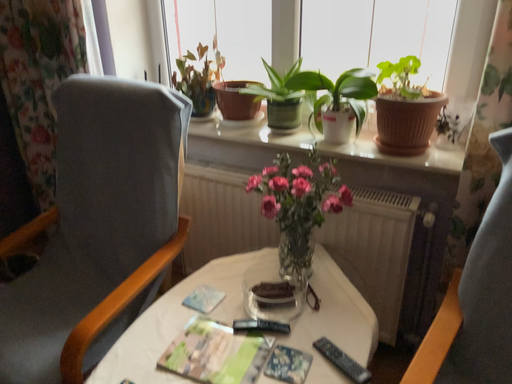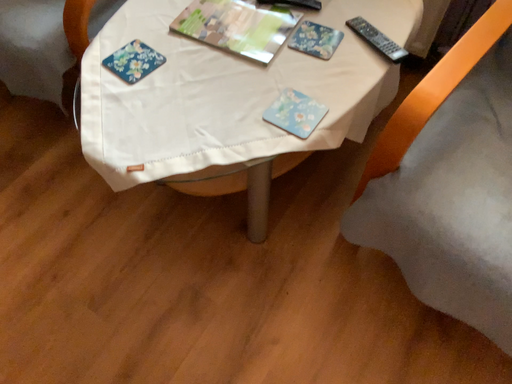
Question: How did the camera likely rotate when shooting the video?

Choices:
 (A) rotated downward
 (B) rotated upward

Answer: (A)